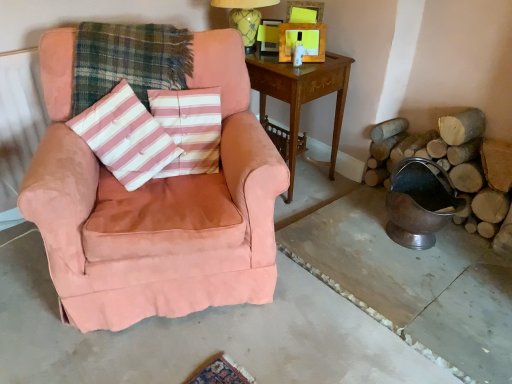
Locate an element on the screen. This screenshot has width=512, height=384. vacant space in polished silver swivel chair at lower right (from a real-world perspective) is located at coordinates (x=422, y=247).